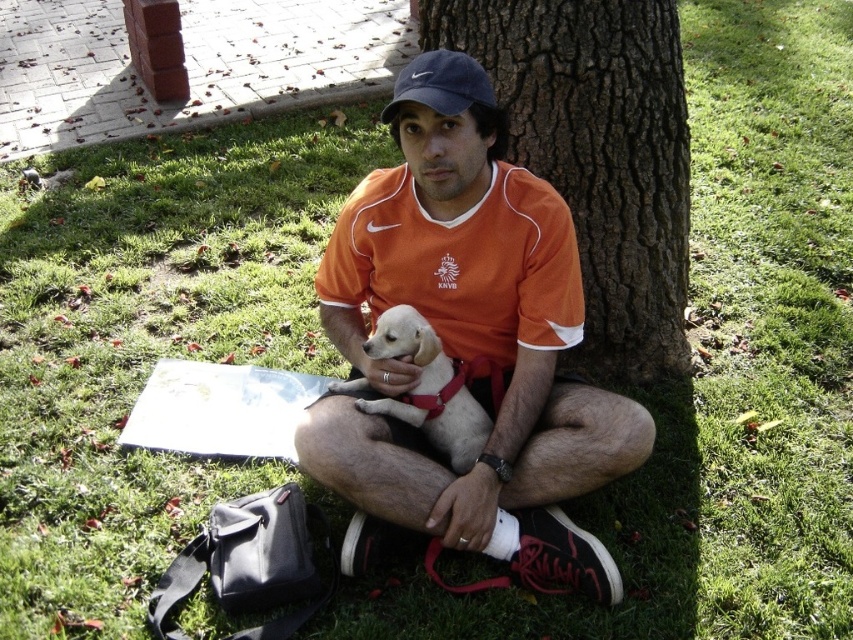
You are a photographer planning to take a portrait of the man and his dog. You want to ensure the orange jersey at center and the white fur dog at center are both clearly visible in the frame. Based on their positions, which object should you focus on first to ensure both are in focus?

The orange jersey at center is positioned on the right side of white fur dog at center. To ensure both are in focus, you should focus on the white fur dog at center first since it is closer to the camera, and the orange jersey at center will naturally fall into the depth of field if focused on the closer subject.

You are a photographer trying to capture a candid shot of the man and his dog. The camera you are using has a focal length of 50mm and an aperture of f2.8. You want to ensure that both the white fur dog at center and the matte blue baseball cap at upper center are in focus. Given the distance between them, what is the maximum distance you can stand from the subject to maintain both in focus without changing any camera settings?

The white fur dog at center and the matte blue baseball cap at upper center are 23.84 inches apart. To keep both in focus with a 50mm lens at f2.8, the hyperfocal distance formula suggests that the maximum distance you can stand while keeping both objects sharp is approximately 11.92 inches from the nearest subject. However, this calculation assumes ideal conditions and may vary slightly based on sensor size and other factors.